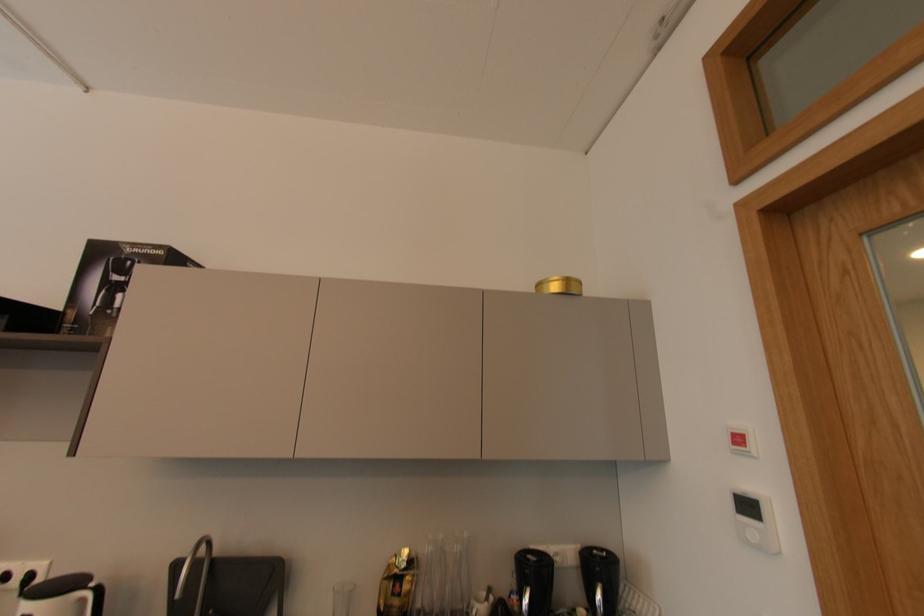
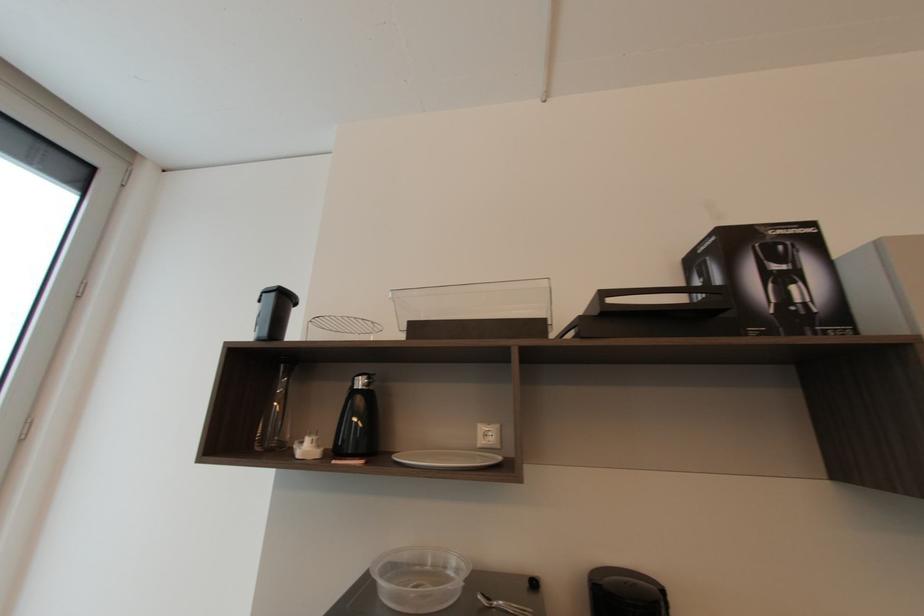
Question: The images are taken continuously from a first-person perspective. In which direction are you moving?

Choices:
 (A) Left
 (B) Right
 (C) Forward
 (D) Backward

Answer: (A)